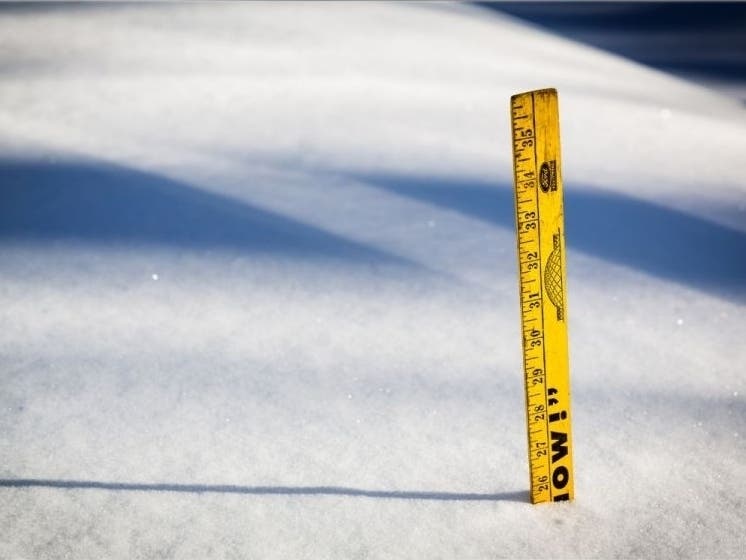
Where is `yellow ruler`? yellow ruler is located at coordinates (553, 371).